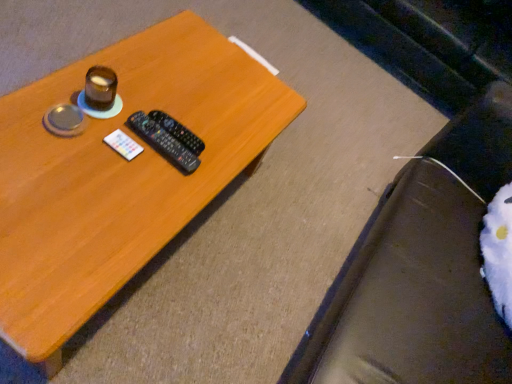
You are a GUI agent. You are given a task and a screenshot of the screen. Output one action in this format:
    pyautogui.click(x=<x>, y=<y>)
    Task: Click on the space that is in front of black plastic remote control at center, placed as the second remote control when sorted from front to back
    The width and height of the screenshot is (512, 384).
    Given the screenshot: What is the action you would take?
    pyautogui.click(x=128, y=177)